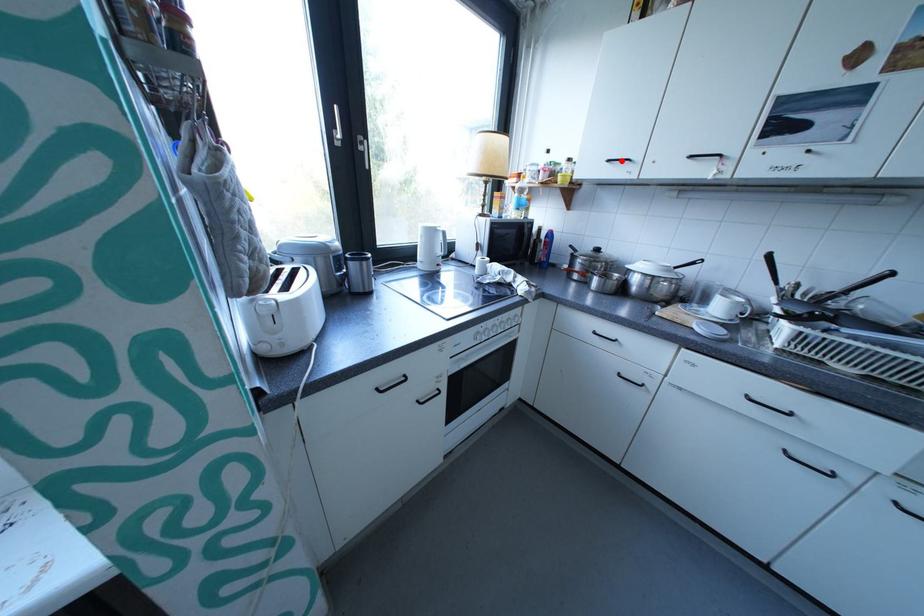
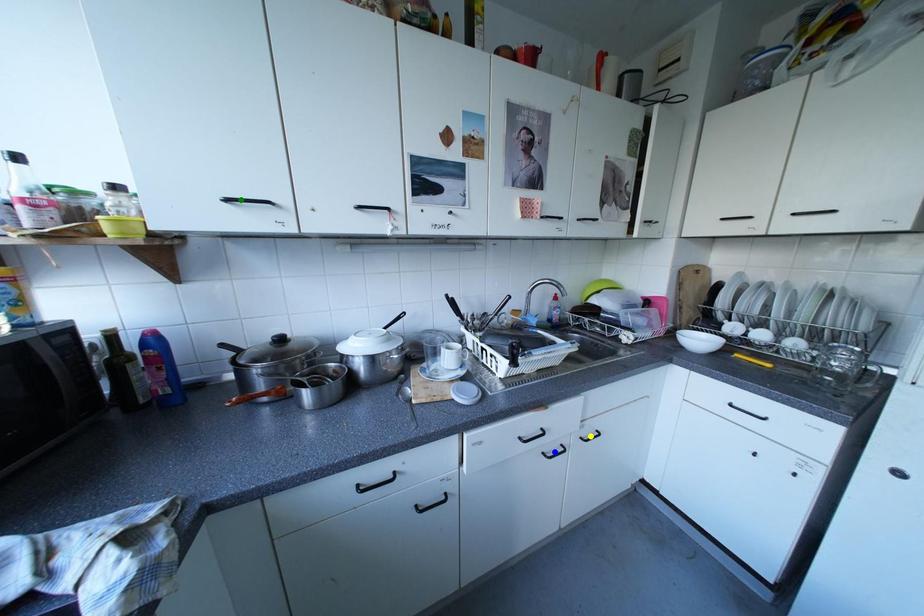
Question: I am providing you with two images of the same scene from different viewpoints. A red point is marked on the first image. You are given multiple points on the second image. Which mark in image 2 goes with the point in image 1?

Choices:
 (A) blue point
 (B) yellow point
 (C) green point

Answer: (C)